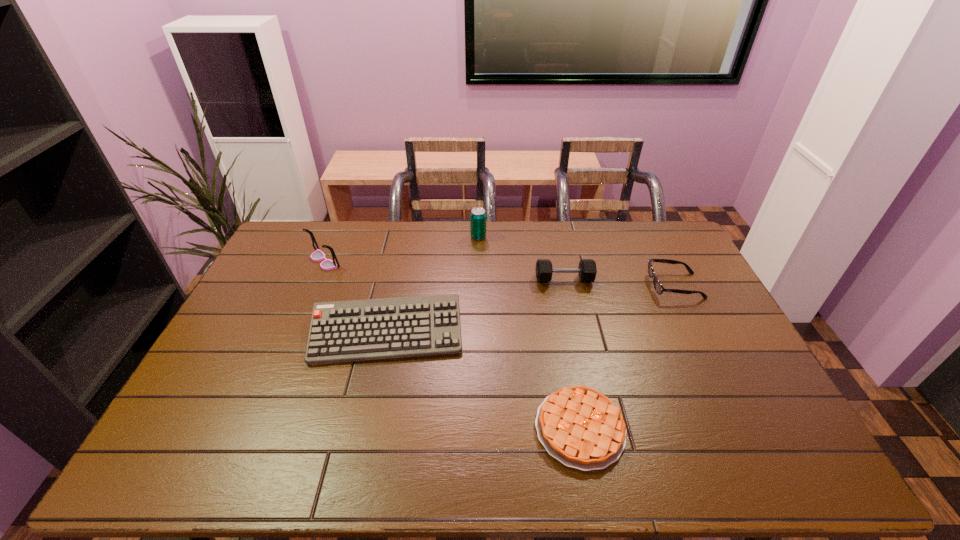
You are a GUI agent. You are given a task and a screenshot of the screen. Output one action in this format:
    pyautogui.click(x=<x>, y=<y>)
    Task: Click on the vacant region located on the front of the taller spectacles
    This screenshot has height=540, width=960.
    Given the screenshot: What is the action you would take?
    pyautogui.click(x=296, y=329)

Find the location of `free space located on the front of the dumbbell`. free space located on the front of the dumbbell is located at coordinates (585, 373).

I want to click on blank space located on the right of the second nearest object, so click(x=572, y=334).

In order to click on vacant space located 0.300m on the lenses of the shorter spectacles in this screenshot , I will do `click(561, 286)`.

The height and width of the screenshot is (540, 960). Find the location of `vacant space located on the lenses of the shorter spectacles`. vacant space located on the lenses of the shorter spectacles is located at coordinates (561, 286).

What are the coordinates of `vacant space located 0.360m on the lenses of the shorter spectacles` in the screenshot? It's located at (543, 286).

This screenshot has height=540, width=960. I want to click on free spot located 0.130m on the back of the pie, so click(x=565, y=352).

Image resolution: width=960 pixels, height=540 pixels. Identify the location of beer can at the far edge. (478, 215).

This screenshot has height=540, width=960. Identify the location of spectacles that is at the far edge. (318, 255).

Where is `object located in the near edge section of the desktop`? This screenshot has height=540, width=960. object located in the near edge section of the desktop is located at coordinates (580, 427).